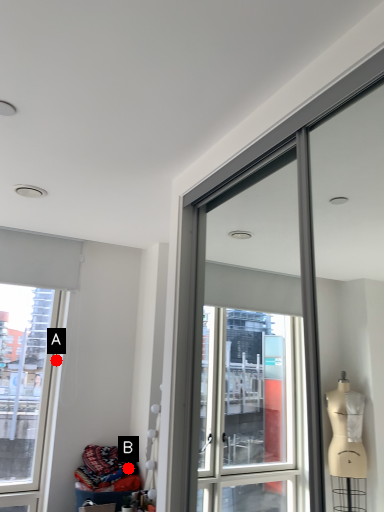
Question: Two points are circled on the image, labeled by A and B beside each circle. Which of the following is the closest to the observer?

Choices:
 (A) A is closer
 (B) B is closer

Answer: (B)